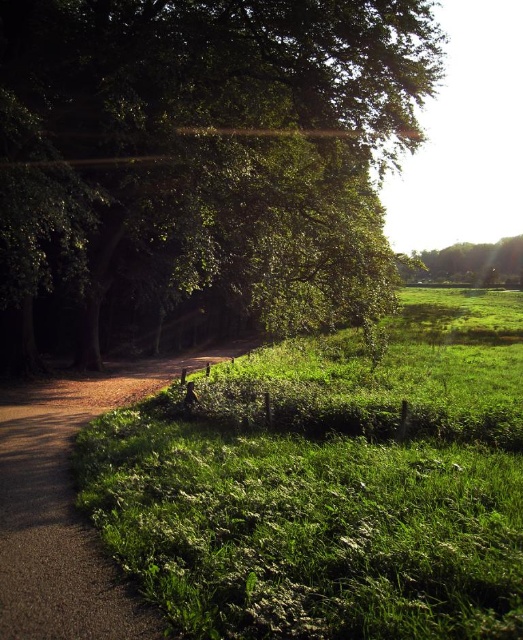
In the scene shown: You are a bird flying over the rural scene and want to land on the tallest tree. Which tree should you choose between the green leafy tree at upper left and the green leafy tree at upper right?

The green leafy tree at upper right is taller than the green leafy tree at upper left, so you should choose the green leafy tree at upper right to land on.

You are planning to set up a picnic area in the green grassy at center and the dull brown dirt path at lower left. Which location would provide more space for your picnic setup?

The green grassy at center is bigger than the dull brown dirt path at lower left, so it would provide more space for your picnic setup.

You are a painter setting up your easel to capture the scene. You want to ensure the green leafy tree at upper left and the dull brown dirt path at lower left are both visible in your painting. Considering their widths, which object should you allocate more space to in your composition?

The green leafy tree at upper left should be allocated more space in the painting since its width surpasses that of the dull brown dirt path at lower left.